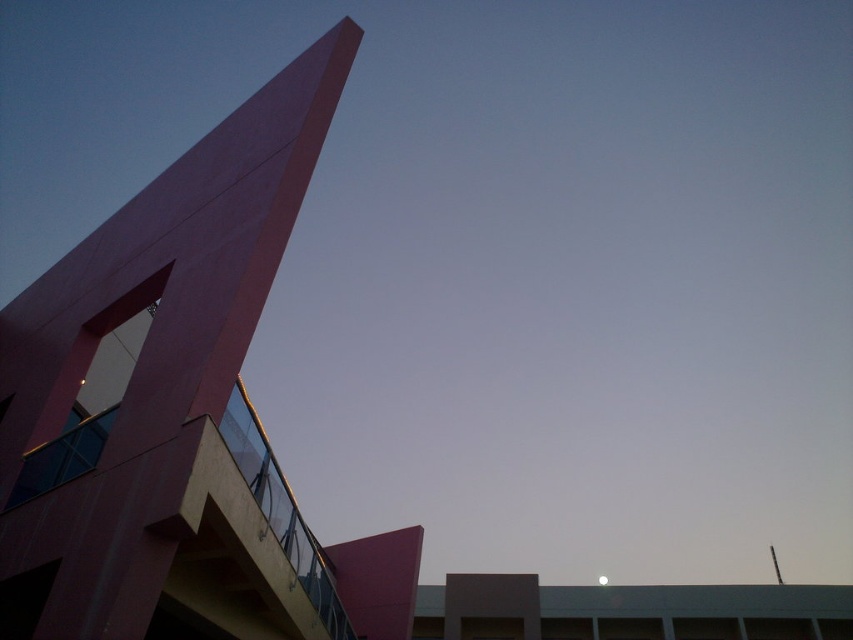
Question: Observing the image, what is the correct spatial positioning of matte pink tower at upper left in reference to white glossy moon at upper center?

Choices:
 (A) below
 (B) above

Answer: (B)

Question: Which point is closer to the camera?

Choices:
 (A) (73, 604)
 (B) (598, 582)

Answer: (A)

Question: Can you confirm if matte pink tower at upper left is positioned to the left of white glossy moon at upper center?

Choices:
 (A) yes
 (B) no

Answer: (A)

Question: Is matte pink tower at upper left thinner than white glossy moon at upper center?

Choices:
 (A) no
 (B) yes

Answer: (B)

Question: Which point is closer to the camera?

Choices:
 (A) white glossy moon at upper center
 (B) matte pink tower at upper left

Answer: (B)